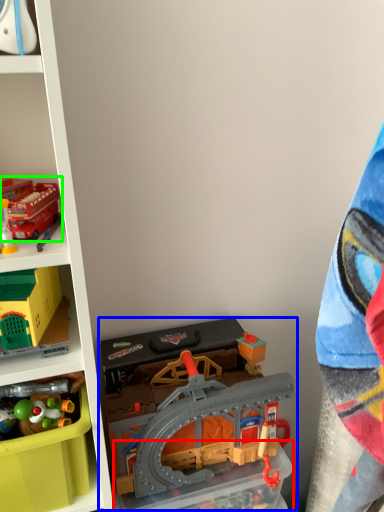
Question: Considering the real-world distances, which object is closest to storage box (highlighted by a red box)? toy (highlighted by a blue box) or toy (highlighted by a green box).

Choices:
 (A) toy
 (B) toy

Answer: (A)